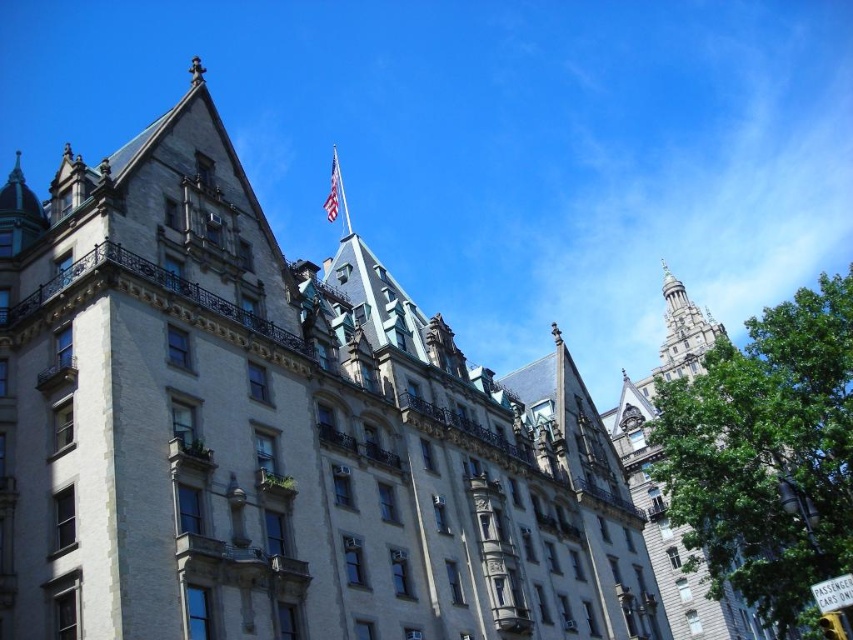
You are a photographer standing in front of the white stone building at center and the american flag at upper center. You want to capture a photo that includes both objects in the frame. Which object should you focus on to ensure both are fully visible?

You should focus on the white stone building at center because it is taller than the american flag at upper center, so by centering the building, the flag will naturally be within the frame as well.

You are an architect analyzing the facade of a historic building. You notice the stone tower at upper right and the american flag at upper center. Which of these two elements has a greater width?

The stone tower at upper right has a greater width than the american flag at upper center.

You are standing in front of the historic building and want to determine the relative positions of two points marked on its facade. Which point, point (469, 480) or point (717, 605), is closer to you?

Point (469, 480) is closer to the viewer than point (717, 605).